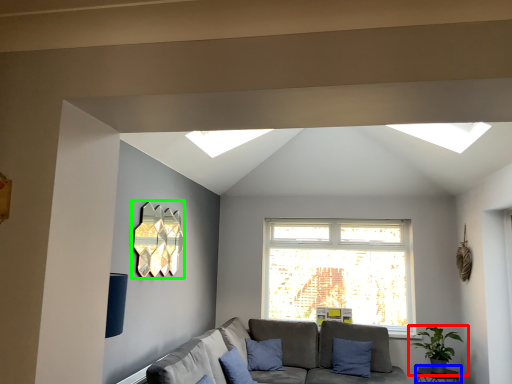
Question: Which object is positioned closest to houseplant (highlighted by a red box)? Select from table (highlighted by a blue box) and lamp (highlighted by a green box).

Choices:
 (A) table
 (B) lamp

Answer: (A)